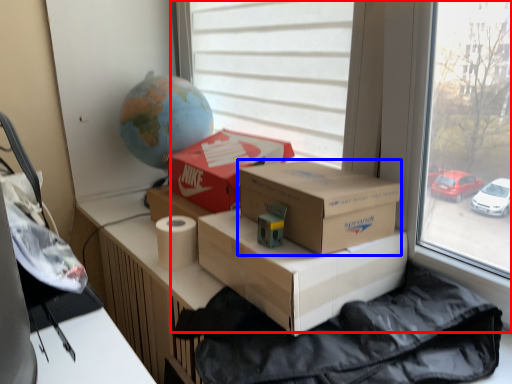
Question: Among these objects, which one is farthest to the camera, window (highlighted by a red box) or box (highlighted by a blue box)?

Choices:
 (A) window
 (B) box

Answer: (B)